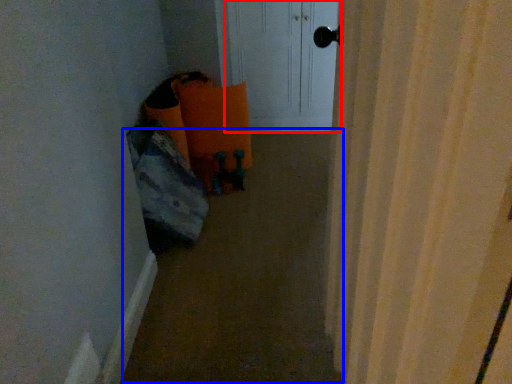
Question: Which object appears farthest to the camera in this image, screen door (highlighted by a red box) or corridor (highlighted by a blue box)?

Choices:
 (A) screen door
 (B) corridor

Answer: (A)